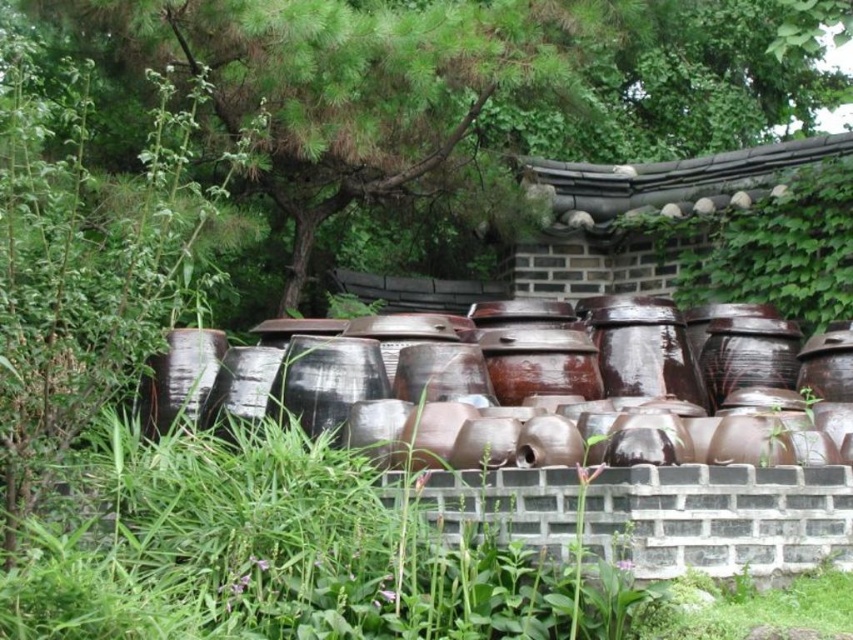
Is point (373, 122) less distant than point (543, 396)?

No, (373, 122) is behind (543, 396).

Can you confirm if green leafy tree at upper center is smaller than brown glazed pottery at center?

No.

This screenshot has width=853, height=640. Describe the element at coordinates (451, 84) in the screenshot. I see `green leafy tree at upper center` at that location.

You are a GUI agent. You are given a task and a screenshot of the screen. Output one action in this format:
    pyautogui.click(x=<x>, y=<y>)
    Task: Click on the green leafy tree at upper center
    The height and width of the screenshot is (640, 853).
    Given the screenshot: What is the action you would take?
    pyautogui.click(x=451, y=84)